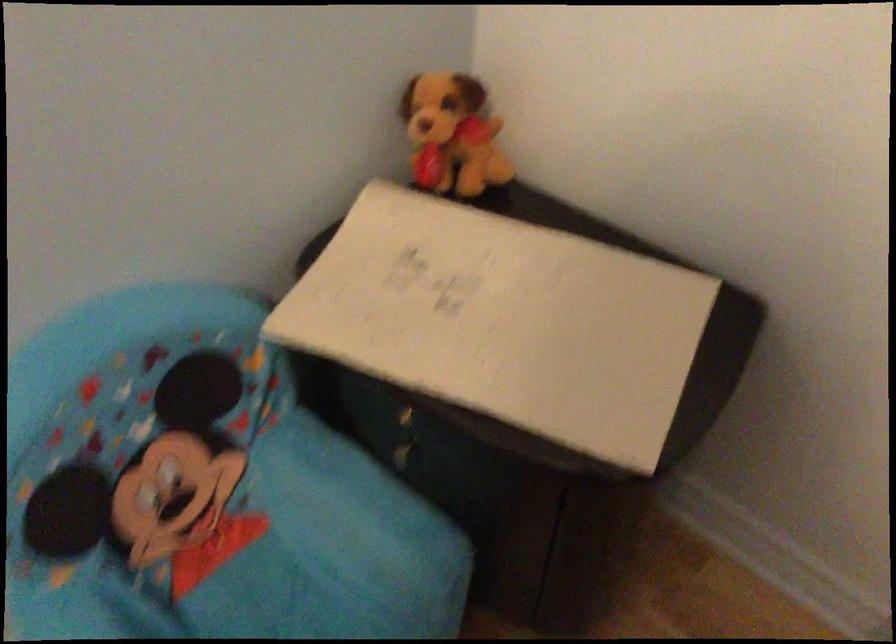
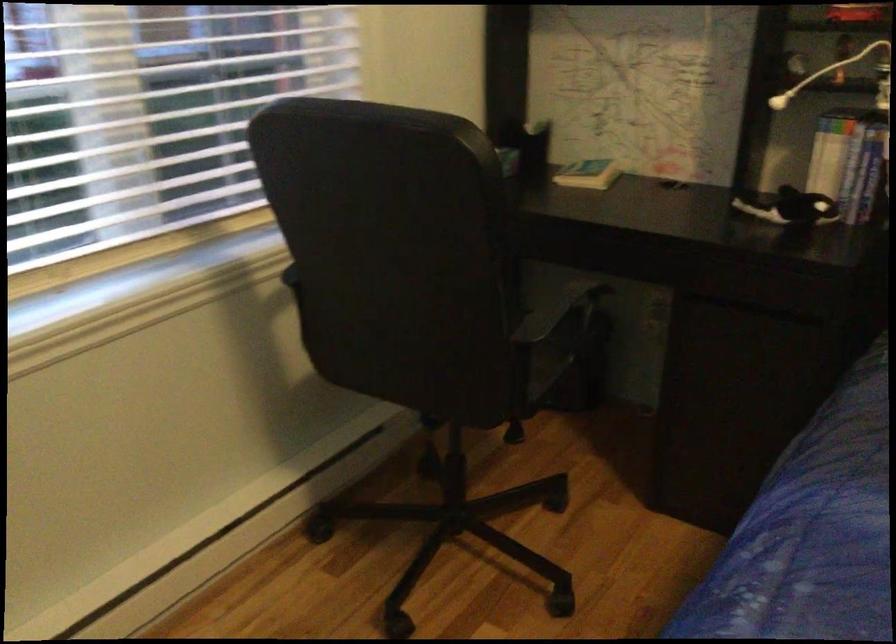
Based on the photo, the first image is from the beginning of the video and the second image is from the end. How did the camera likely rotate when shooting the video?

The rotation direction of the camera is right-down.